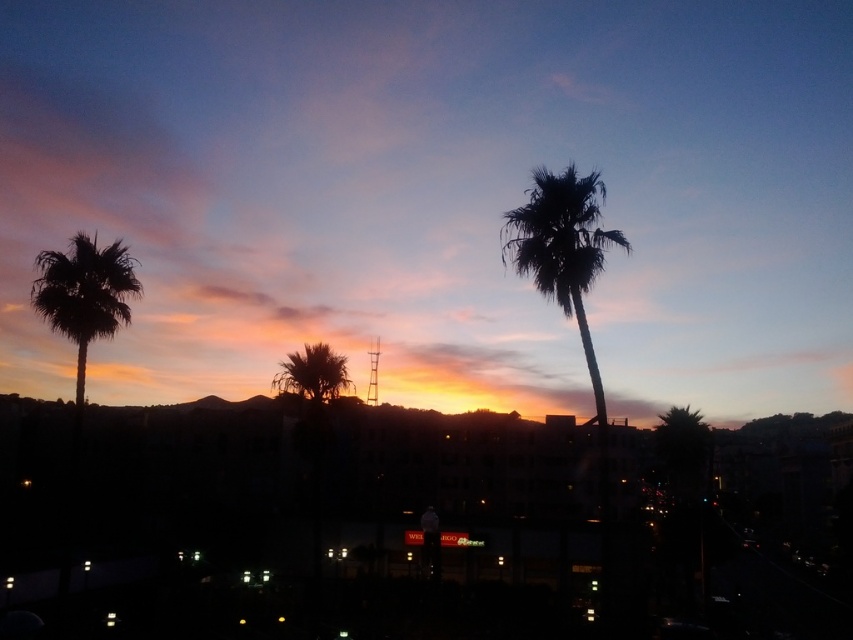
Between silhouette palm at center and silky brown palm tree at center, which one is positioned higher?

silhouette palm at center

Can you confirm if silhouette palm at center is positioned to the right of silky brown palm tree at center?

Correct, you'll find silhouette palm at center to the right of silky brown palm tree at center.

Between point (547, 282) and point (318, 346), which one is positioned in front?

Positioned in front is point (547, 282).

You are a GUI agent. You are given a task and a screenshot of the screen. Output one action in this format:
    pyautogui.click(x=<x>, y=<y>)
    Task: Click on the silhouette palm at center
    
    Given the screenshot: What is the action you would take?
    pyautogui.click(x=561, y=248)

Describe the element at coordinates (561, 248) in the screenshot. This screenshot has width=853, height=640. I see `silhouette palm at center` at that location.

Which of these two, silhouette palm at center or silhouette palm at left, stands shorter?

With less height is silhouette palm at left.

What do you see at coordinates (561, 248) in the screenshot?
I see `silhouette palm at center` at bounding box center [561, 248].

Locate an element on the screen. This screenshot has height=640, width=853. silhouette palm at center is located at coordinates (561, 248).

Can you confirm if silhouette palm at left is positioned above silky brown palm tree at center?

Yes, silhouette palm at left is above silky brown palm tree at center.

Who is more distant from viewer, (41, 305) or (305, 371)?

Positioned behind is point (305, 371).

Which is in front, point (115, 241) or point (282, 369)?

Point (282, 369) is in front.

Find the location of a particular element. silhouette palm at left is located at coordinates (84, 292).